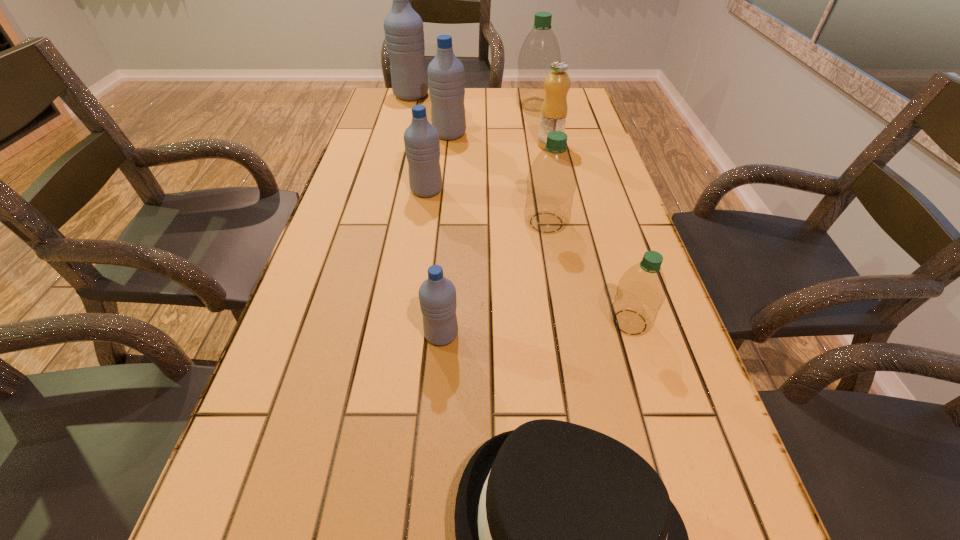
Where is `the smallest blue water bottle`? the smallest blue water bottle is located at coordinates 437,295.

The image size is (960, 540). I want to click on the smallest green water bottle, so click(x=641, y=291).

Locate an element on the screen. Image resolution: width=960 pixels, height=540 pixels. free region located 0.070m on the right of the leftmost water bottle is located at coordinates (447, 96).

Locate an element on the screen. free spot located 0.180m on the left of the farthest green water bottle is located at coordinates (467, 105).

Identify the location of free spot located 0.370m on the right of the third farthest water bottle. (578, 134).

You are a GUI agent. You are given a task and a screenshot of the screen. Output one action in this format:
    pyautogui.click(x=<x>, y=<y>)
    Task: Click on the free location located 0.090m on the front label of the fruit juice
    This screenshot has height=540, width=960.
    Given the screenshot: What is the action you would take?
    pyautogui.click(x=510, y=145)

Find the location of a particular element. Image resolution: width=960 pixels, height=540 pixels. free location located 0.320m on the front label of the fruit juice is located at coordinates (438, 145).

Locate an element on the screen. The height and width of the screenshot is (540, 960). blank space located 0.190m on the front label of the fruit juice is located at coordinates (478, 145).

Identify the location of free space located on the back of the fifth farthest object. The image size is (960, 540). [436, 129].

Find the location of a particular element. The image size is (960, 540). free space located on the right of the fourth nearest object is located at coordinates click(624, 222).